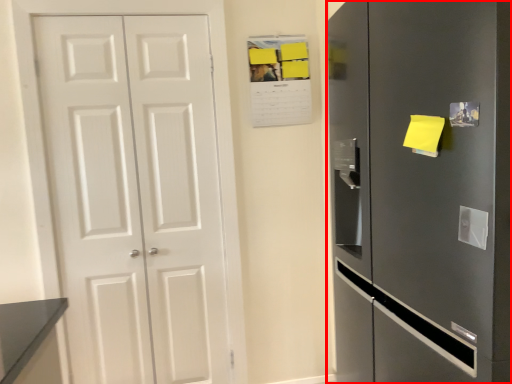
Question: From the image's perspective, where is refrigerator (annotated by the red box) located relative to door?

Choices:
 (A) below
 (B) above

Answer: (A)